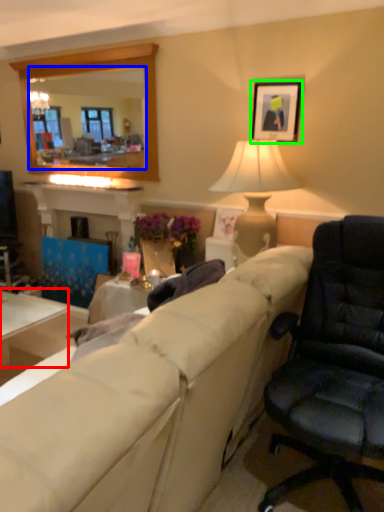
Question: Based on their relative distances, which object is farther from table (highlighted by a red box)? Choose from mirror (highlighted by a blue box) and picture frame (highlighted by a green box).

Choices:
 (A) mirror
 (B) picture frame

Answer: (A)